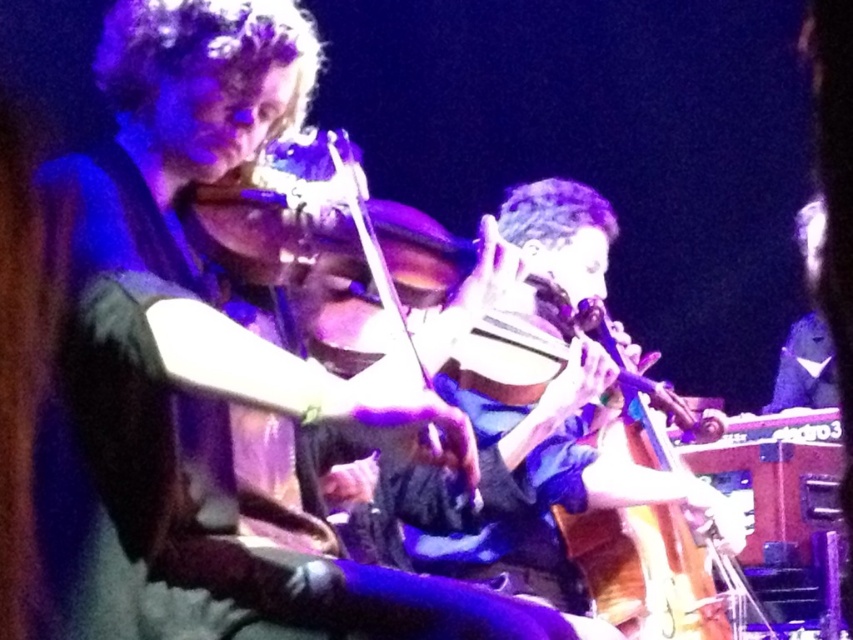
Question: Does matte black violin at upper center appear over wooden violin at center?

Choices:
 (A) yes
 (B) no

Answer: (B)

Question: Which point is farther to the camera?

Choices:
 (A) matte black violin at upper center
 (B) wooden violin at center

Answer: (B)

Question: In this image, where is matte black violin at upper center located relative to wooden violin at center?

Choices:
 (A) above
 (B) below

Answer: (B)

Question: Which point is closer to the camera?

Choices:
 (A) matte black violin at upper center
 (B) wooden violin at center

Answer: (A)

Question: Which object appears closest to the camera in this image?

Choices:
 (A) wooden violin at center
 (B) matte black violin at upper center

Answer: (B)

Question: Is matte black violin at upper center to the right of wooden violin at center from the viewer's perspective?

Choices:
 (A) yes
 (B) no

Answer: (B)